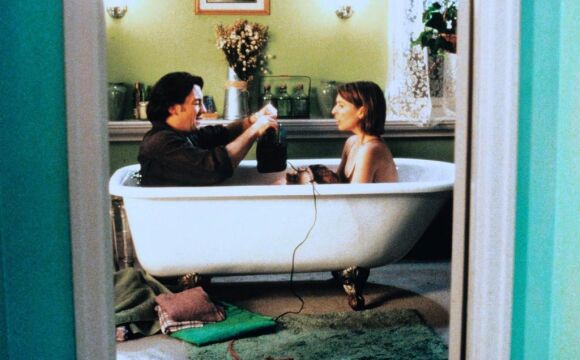
Identify the location of striped plaid towel in white and pink. The width and height of the screenshot is (580, 360). point(169,324).